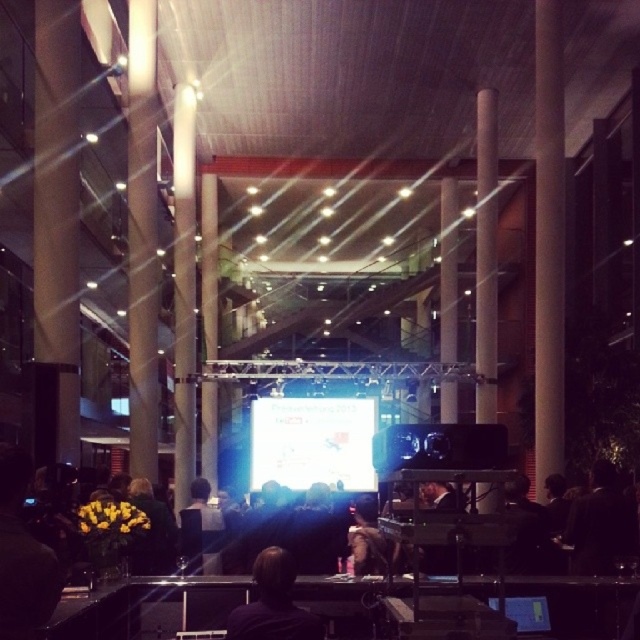
You are a photographer setting up for an event in this space. You notice two people with dark brown hair at center and dark hair at center. Which person has hair that is narrower?

The dark brown hair at center has a lesser width compared to dark hair at center, so the person with dark brown hair at center has narrower hair.

Consider the image. You are attending a conference in the described space and notice two people with dark brown hair at center and dark hair at center. Which person is standing closer to you?

The dark brown hair at center is closer to the viewer than dark hair at center.